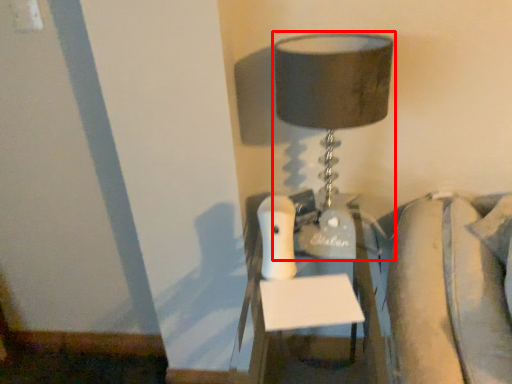
Question: From the image's perspective, where is lamp (annotated by the red box) located in relation to furniture in the image?

Choices:
 (A) above
 (B) below

Answer: (A)